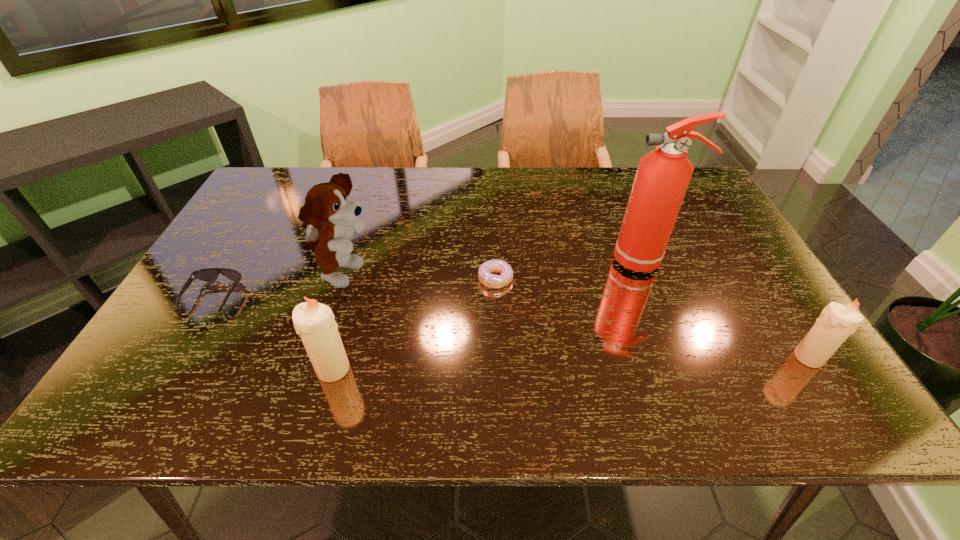
You are a GUI agent. You are given a task and a screenshot of the screen. Output one action in this format:
    pyautogui.click(x=<x>, y=<y>)
    Task: Click on the empty space that is in between the doughnut and the rightmost object
    This screenshot has height=540, width=960.
    Given the screenshot: What is the action you would take?
    652,318

Identify the location of unoccupied position between the second tallest object and the rightmost object. (575, 316).

At what (x,y) coordinates should I click in order to perform the action: click on free space that is in between the sunglasses and the fourth object from left to right. Please return your answer as a coordinate pair (x, y). This screenshot has width=960, height=540. Looking at the image, I should click on point(354,288).

Image resolution: width=960 pixels, height=540 pixels. I want to click on free area in between the sunglasses and the right candle, so click(511, 328).

What are the coordinates of `vacant area that lies between the fifth shortest object and the right candle` in the screenshot? It's located at (575, 316).

This screenshot has width=960, height=540. In order to click on the fifth closest object to the puppy in this screenshot , I will do `click(837, 322)`.

In order to click on the second closest object to the right candle in this screenshot , I will do `click(489, 280)`.

I want to click on free spot that satisfies the following two spatial constraints: 1. at the nozzle of the fire extinguisher; 2. on the front-facing side of the sunglasses, so click(661, 298).

In order to click on free space that satisfies the following two spatial constraints: 1. on the back side of the left candle; 2. on the face of the puppy in this screenshot , I will do `click(360, 275)`.

This screenshot has height=540, width=960. I want to click on vacant space that satisfies the following two spatial constraints: 1. on the back side of the right candle; 2. on the left side of the third tallest object, so click(x=336, y=357).